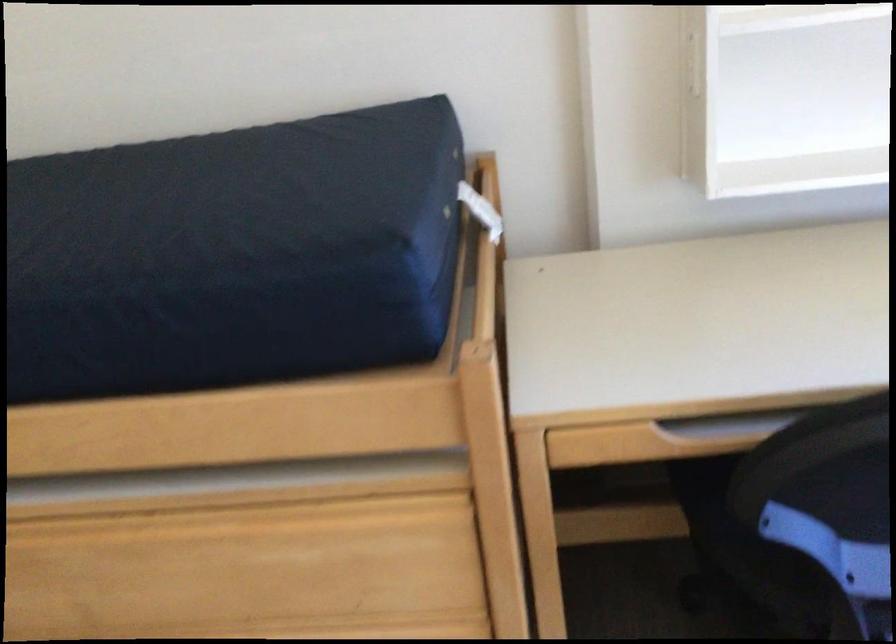
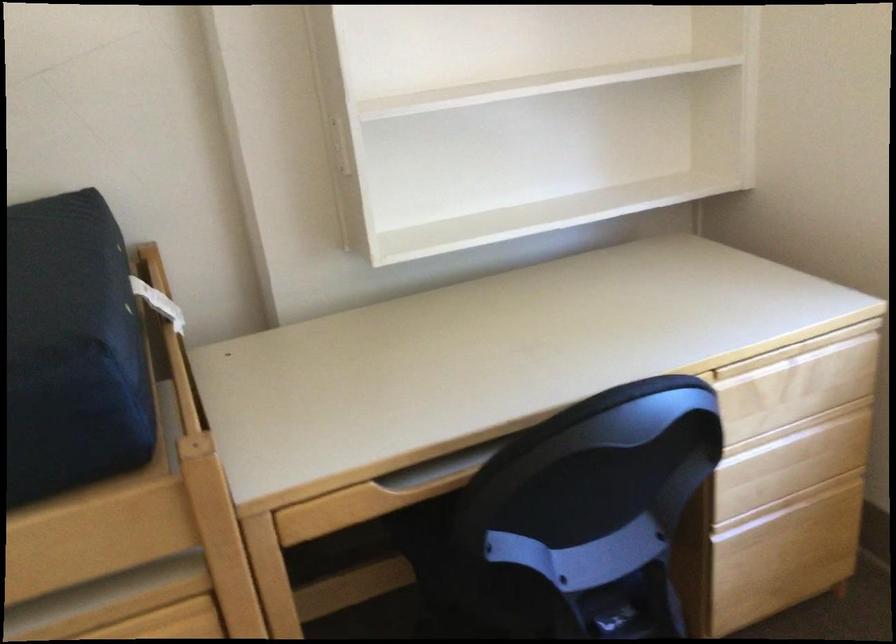
In a continuous first-person perspective shot, in which direction is the camera moving?

The cameraman walked toward left, backward.